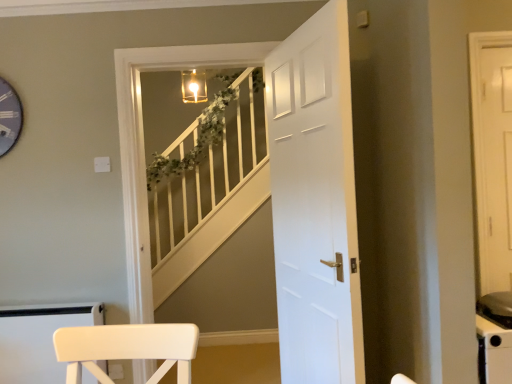
Question: Is white matte door at center bigger than white wooden staircase at center?

Choices:
 (A) yes
 (B) no

Answer: (A)

Question: Is white matte door at center facing away from white wooden staircase at center?

Choices:
 (A) no
 (B) yes

Answer: (A)

Question: From the image's perspective, is white matte door at center below white wooden staircase at center?

Choices:
 (A) no
 (B) yes

Answer: (A)

Question: Could white wooden staircase at center be considered to be inside white matte door at center?

Choices:
 (A) yes
 (B) no

Answer: (B)

Question: Considering the relative sizes of white matte door at center and white wooden staircase at center in the image provided, is white matte door at center wider than white wooden staircase at center?

Choices:
 (A) no
 (B) yes

Answer: (A)

Question: Can you confirm if white matte door at center is positioned to the right of white wooden staircase at center?

Choices:
 (A) no
 (B) yes

Answer: (B)

Question: Can you confirm if white wooden staircase at center is positioned to the right of white matte door at center?

Choices:
 (A) no
 (B) yes

Answer: (A)

Question: Is there a large distance between white wooden staircase at center and white matte door at center?

Choices:
 (A) no
 (B) yes

Answer: (B)

Question: Is white wooden staircase at center positioned behind white matte door at center?

Choices:
 (A) no
 (B) yes

Answer: (B)

Question: Does white wooden staircase at center come in front of white matte door at center?

Choices:
 (A) yes
 (B) no

Answer: (B)

Question: Is white wooden staircase at center surrounding white matte door at center?

Choices:
 (A) yes
 (B) no

Answer: (B)

Question: Considering the relative sizes of white wooden staircase at center and white matte door at center in the image provided, is white wooden staircase at center thinner than white matte door at center?

Choices:
 (A) no
 (B) yes

Answer: (A)

Question: Looking at their shapes, would you say white wooden staircase at center is wider or thinner than white matte door at center?

Choices:
 (A) wide
 (B) thin

Answer: (A)